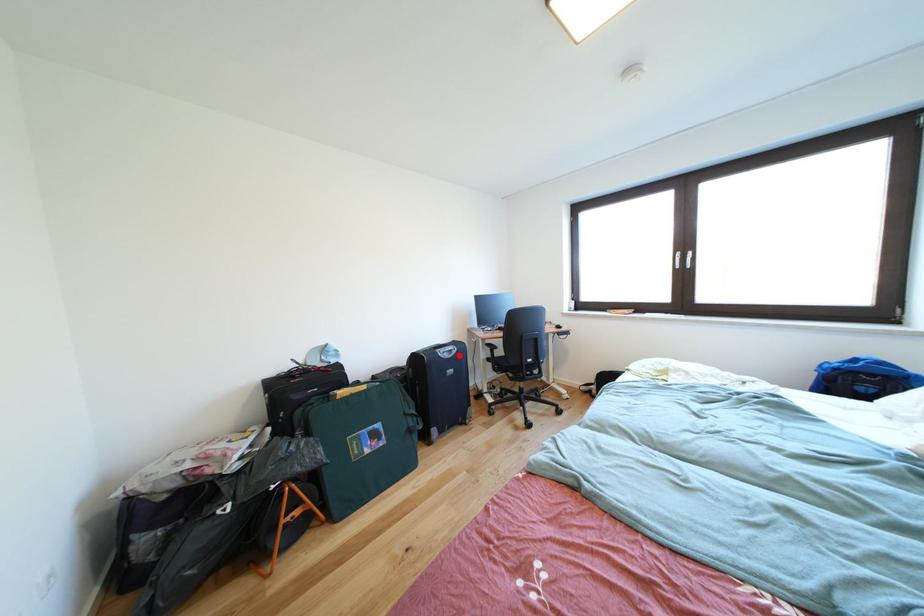
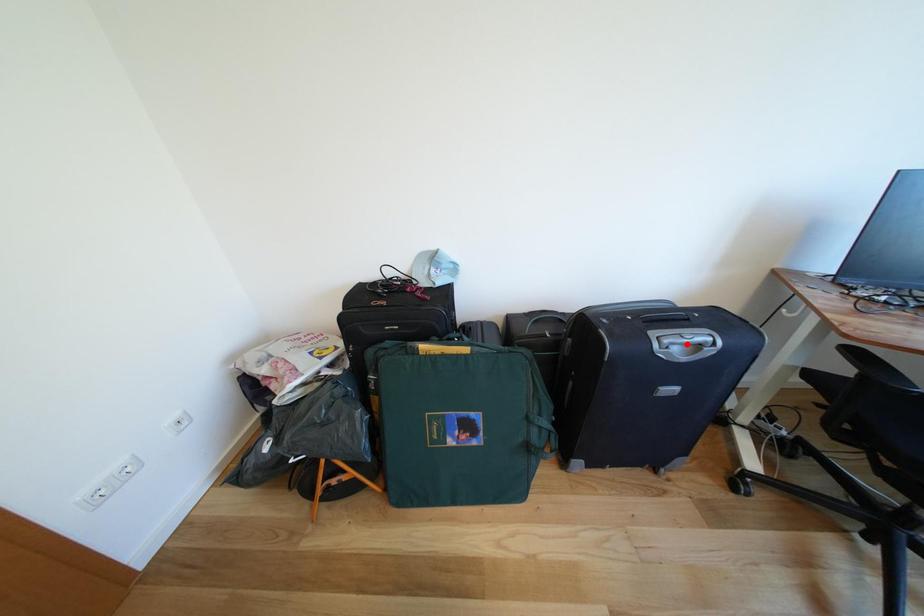
I am providing you with two images of the same scene from different viewpoints. A red point is marked on the first image and another point is marked on the second image. Is the red point in image1 aligned with the point shown in image2?

No